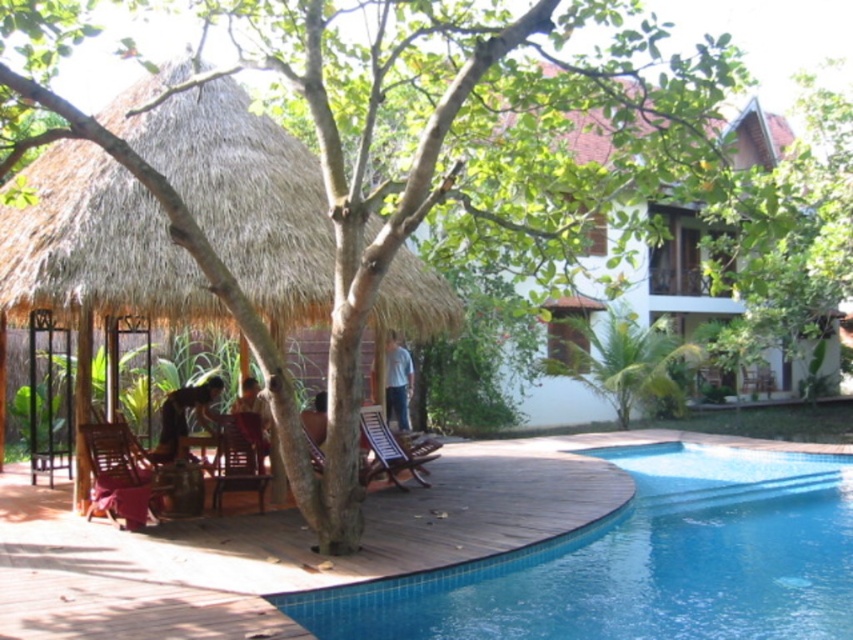
Is dark brown wooden chair at lower left below smooth brown skin at lower center?

Yes.

Who is taller, dark brown wooden chair at lower left or smooth brown skin at lower center?

Standing taller between the two is dark brown wooden chair at lower left.

Which is behind, point (206, 401) or point (321, 400)?

Positioned behind is point (206, 401).

What are the coordinates of `dark brown wooden chair at lower left` in the screenshot? It's located at tap(183, 419).

Is wooden chair at lower center taller than blue jeans at center?

In fact, wooden chair at lower center may be shorter than blue jeans at center.

Is wooden chair at lower center below blue jeans at center?

Yes, wooden chair at lower center is below blue jeans at center.

Does point (241, 445) lie behind point (386, 376)?

No.

The width and height of the screenshot is (853, 640). Identify the location of wooden chair at lower center. (239, 458).

Is point (630, 385) more distant than point (306, 410)?

Yes, point (630, 385) is behind point (306, 410).

Does green leafy tree at center have a greater height compared to smooth brown skin at lower center?

Yes.

The height and width of the screenshot is (640, 853). What do you see at coordinates (621, 362) in the screenshot?
I see `green leafy tree at center` at bounding box center [621, 362].

Find the location of a particular element. Image resolution: width=853 pixels, height=640 pixels. green leafy tree at center is located at coordinates (621, 362).